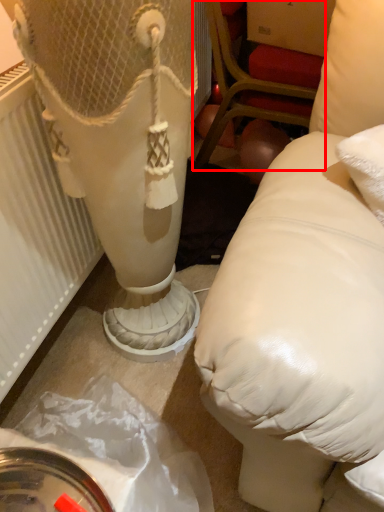
Question: From the image's perspective, considering the relative positions of furniture (annotated by the red box) and radiator in the image provided, where is furniture (annotated by the red box) located with respect to the staircase?

Choices:
 (A) below
 (B) above

Answer: (B)